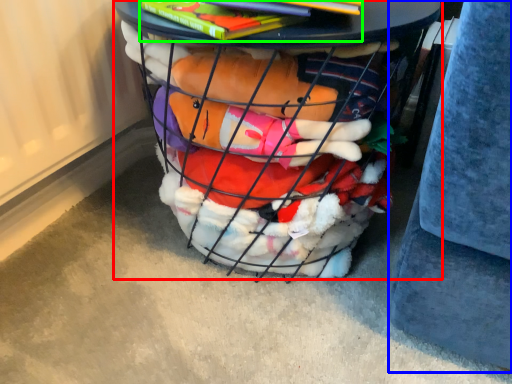
Question: Which object is the farthest from furniture (highlighted by a red box)? Choose among these: gray (highlighted by a blue box) or book (highlighted by a green box).

Choices:
 (A) gray
 (B) book

Answer: (A)